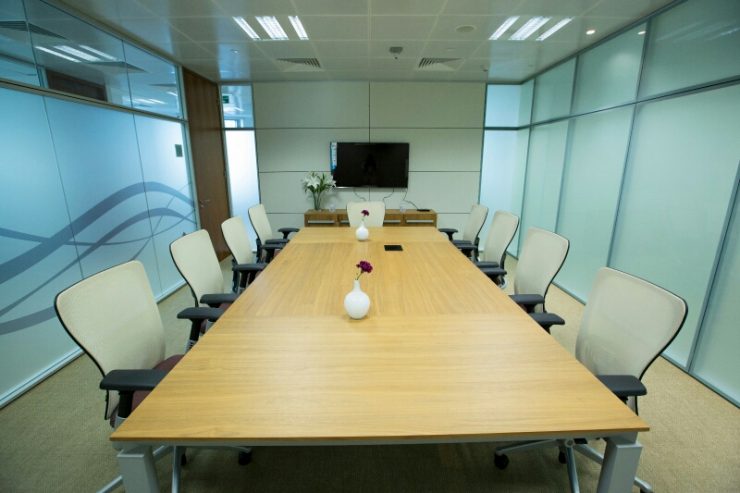
Where is `wooden door`? wooden door is located at coordinates (209, 173).